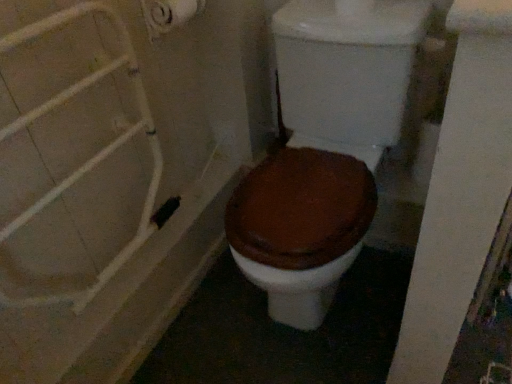
Question: Is brown matte toilet at center aimed at white matte toilet paper at upper left?

Choices:
 (A) yes
 (B) no

Answer: (B)

Question: From a real-world perspective, is brown matte toilet at center positioned under white matte toilet paper at upper left based on gravity?

Choices:
 (A) yes
 (B) no

Answer: (A)

Question: Considering the relative sizes of brown matte toilet at center and white matte toilet paper at upper left in the image provided, is brown matte toilet at center smaller than white matte toilet paper at upper left?

Choices:
 (A) yes
 (B) no

Answer: (B)

Question: Is brown matte toilet at center taller than white matte toilet paper at upper left?

Choices:
 (A) no
 (B) yes

Answer: (B)

Question: From the image's perspective, is brown matte toilet at center on white matte toilet paper at upper left?

Choices:
 (A) no
 (B) yes

Answer: (A)

Question: Is brown matte toilet at center spatially inside white matte toilet paper at upper left, or outside of it?

Choices:
 (A) inside
 (B) outside

Answer: (B)

Question: Is point (241, 253) closer or farther from the camera than point (154, 26)?

Choices:
 (A) farther
 (B) closer

Answer: (B)

Question: Looking at their shapes, would you say brown matte toilet at center is wider or thinner than white matte toilet paper at upper left?

Choices:
 (A) wide
 (B) thin

Answer: (A)

Question: From the image's perspective, relative to white matte toilet paper at upper left, is brown matte toilet at center above or below?

Choices:
 (A) below
 (B) above

Answer: (A)

Question: From the image's perspective, relative to brown matte toilet at center, is white matte shower door at left above or below?

Choices:
 (A) above
 (B) below

Answer: (B)

Question: Relative to brown matte toilet at center, is white matte shower door at left in front or behind?

Choices:
 (A) behind
 (B) front

Answer: (B)

Question: Considering the relative positions of white matte shower door at left and brown matte toilet at center in the image provided, is white matte shower door at left to the left or to the right of brown matte toilet at center?

Choices:
 (A) left
 (B) right

Answer: (A)

Question: Which is correct: white matte shower door at left is inside brown matte toilet at center, or outside of it?

Choices:
 (A) inside
 (B) outside

Answer: (B)

Question: Is brown matte toilet at center spatially inside white matte shower door at left, or outside of it?

Choices:
 (A) inside
 (B) outside

Answer: (B)

Question: From the image's perspective, is brown matte toilet at center positioned above or below white matte shower door at left?

Choices:
 (A) above
 (B) below

Answer: (A)